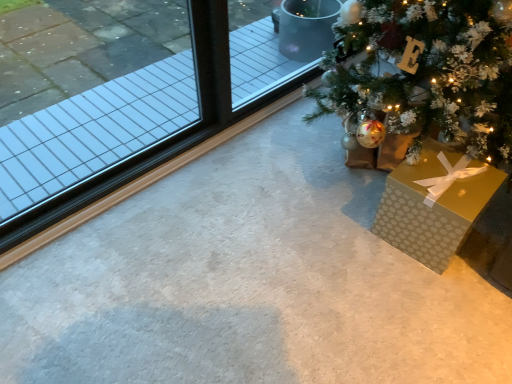
Describe the element at coordinates (142, 117) in the screenshot. I see `clear glass window at left` at that location.

Measure the distance between point (175, 75) and camera.

9.05 feet.

I want to click on clear glass window at left, so click(142, 117).

The image size is (512, 384). What are the coordinates of `gold paper gift at lower right` in the screenshot? It's located at 434,203.

Describe the element at coordinates (434, 203) in the screenshot. I see `gold paper gift at lower right` at that location.

Locate an element on the screen. The width and height of the screenshot is (512, 384). clear glass window at left is located at coordinates (142, 117).

Would you say gold paper gift at lower right is to the left or to the right of clear glass window at left in the picture?

gold paper gift at lower right is positioned on clear glass window at left's right side.

Which object is further away from the camera taking this photo, gold paper gift at lower right or clear glass window at left?

Positioned behind is gold paper gift at lower right.

Is point (496, 190) positioned in front of point (191, 62)?

That is True.

From the image's perspective, who appears lower, gold paper gift at lower right or clear glass window at left?

gold paper gift at lower right, from the image's perspective.

From a real-world perspective, between gold paper gift at lower right and clear glass window at left, who is vertically higher?

clear glass window at left, from a real-world perspective.

Consider the image. Looking at their sizes, would you say gold paper gift at lower right is wider or thinner than clear glass window at left?

Considering their sizes, gold paper gift at lower right looks broader than clear glass window at left.

Who is taller, gold paper gift at lower right or clear glass window at left?

Standing taller between the two is clear glass window at left.

Can you confirm if gold paper gift at lower right is bigger than clear glass window at left?

No, gold paper gift at lower right is not bigger than clear glass window at left.

Is gold paper gift at lower right situated inside clear glass window at left or outside?

gold paper gift at lower right exists outside the volume of clear glass window at left.

Would you consider gold paper gift at lower right to be distant from clear glass window at left?

That's right, there is a large distance between gold paper gift at lower right and clear glass window at left.

Is gold paper gift at lower right facing away from clear glass window at left?

gold paper gift at lower right does not have its back to clear glass window at left.

Where is `window on the left of gold paper gift at lower right`? This screenshot has height=384, width=512. window on the left of gold paper gift at lower right is located at coordinates (142, 117).

Which is more to the right, clear glass window at left or gold paper gift at lower right?

From the viewer's perspective, gold paper gift at lower right appears more on the right side.

Is clear glass window at left behind gold paper gift at lower right?

No, clear glass window at left is closer to the viewer.

Is point (136, 16) positioned before point (418, 229)?

No, (136, 16) is further to viewer.

From the image's perspective, which is below, clear glass window at left or gold paper gift at lower right?

gold paper gift at lower right appears lower in the image.

Based on the photo, from a real-world perspective, does clear glass window at left stand above gold paper gift at lower right?

Yes.

Which object is wider, clear glass window at left or gold paper gift at lower right?

gold paper gift at lower right is wider.

Considering the sizes of objects clear glass window at left and gold paper gift at lower right in the image provided, who is taller, clear glass window at left or gold paper gift at lower right?

clear glass window at left.

Considering the sizes of objects clear glass window at left and gold paper gift at lower right in the image provided, who is bigger, clear glass window at left or gold paper gift at lower right?

clear glass window at left.

Would you say clear glass window at left is inside or outside gold paper gift at lower right?

clear glass window at left lies outside gold paper gift at lower right.

Is clear glass window at left in contact with gold paper gift at lower right?

No, clear glass window at left is not touching gold paper gift at lower right.

Is clear glass window at left aimed at gold paper gift at lower right?

Yes, clear glass window at left is turned towards gold paper gift at lower right.

How different are the orientations of clear glass window at left and gold paper gift at lower right in degrees?

There is a 86.3-degree angle between the facing directions of clear glass window at left and gold paper gift at lower right.

Image resolution: width=512 pixels, height=384 pixels. I want to click on gift box behind the clear glass window at left, so click(x=434, y=203).

This screenshot has height=384, width=512. I want to click on gift box below the clear glass window at left (from a real-world perspective), so click(434, 203).

I want to click on gift box behind the clear glass window at left, so click(x=434, y=203).